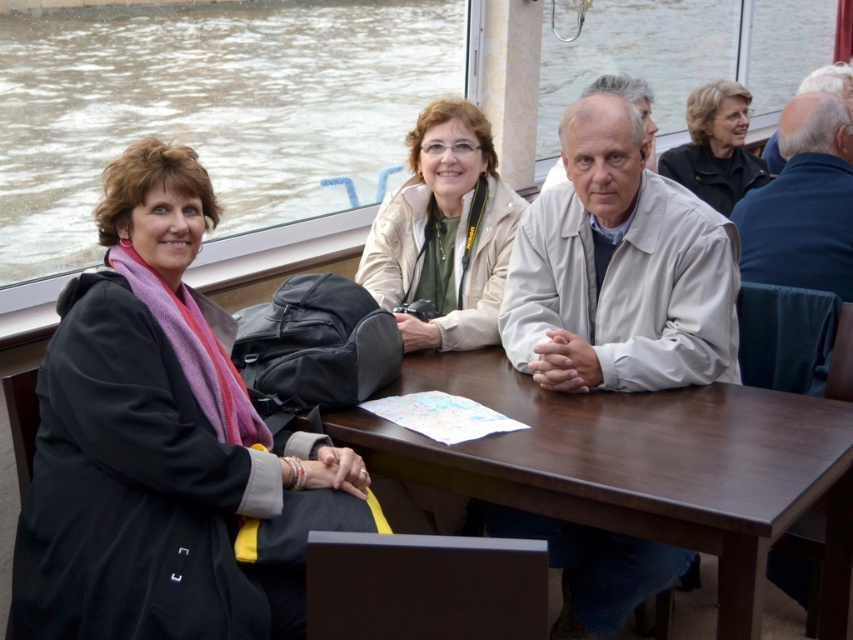
Question: Which point appears farthest from the camera in this image?

Choices:
 (A) (706, 401)
 (B) (672, 154)
 (C) (467, 296)

Answer: (B)

Question: Among these points, which one is farthest from the camera?

Choices:
 (A) (808, 209)
 (B) (811, 44)
 (C) (445, 109)

Answer: (B)

Question: Which point is farther from the camera taking this photo?

Choices:
 (A) (831, 248)
 (B) (698, 189)

Answer: (B)

Question: Does light beige leather jacket at center have a larger size compared to light beige jacket at center?

Choices:
 (A) no
 (B) yes

Answer: (B)

Question: Does light beige leather jacket at center have a larger size compared to white matte jacket at center?

Choices:
 (A) no
 (B) yes

Answer: (A)

Question: Is white matte jacket at center thinner than gray hair at upper right?

Choices:
 (A) yes
 (B) no

Answer: (A)